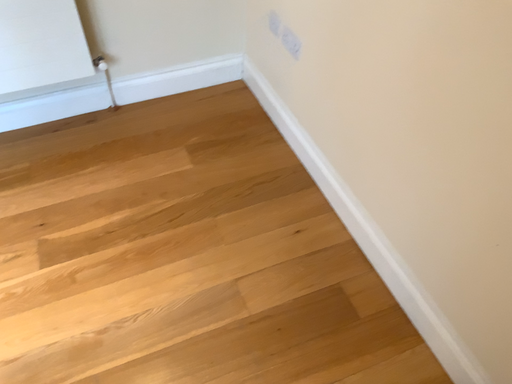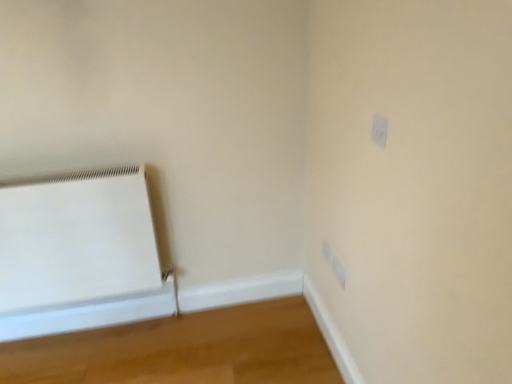
Question: How did the camera likely rotate when shooting the video?

Choices:
 (A) rotated upward
 (B) rotated downward

Answer: (A)